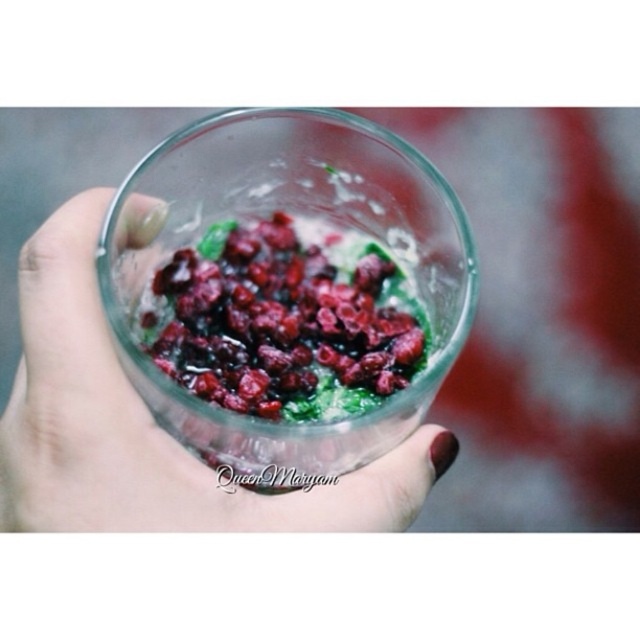
Question: Which object is closer to the camera taking this photo?

Choices:
 (A) clear glass cup at center
 (B) glossy red berries at center

Answer: (A)

Question: Does clear glass cup at center lie behind glossy red berries at center?

Choices:
 (A) no
 (B) yes

Answer: (A)

Question: Is clear glass cup at center to the left of glossy red berries at center from the viewer's perspective?

Choices:
 (A) no
 (B) yes

Answer: (B)

Question: Which of the following is the farthest from the observer?

Choices:
 (A) glossy red berries at center
 (B) clear glass cup at center

Answer: (A)

Question: Which of the following is the closest to the observer?

Choices:
 (A) glossy red berries at center
 (B) clear glass cup at center

Answer: (B)

Question: Is clear glass cup at center thinner than glossy red berries at center?

Choices:
 (A) no
 (B) yes

Answer: (A)